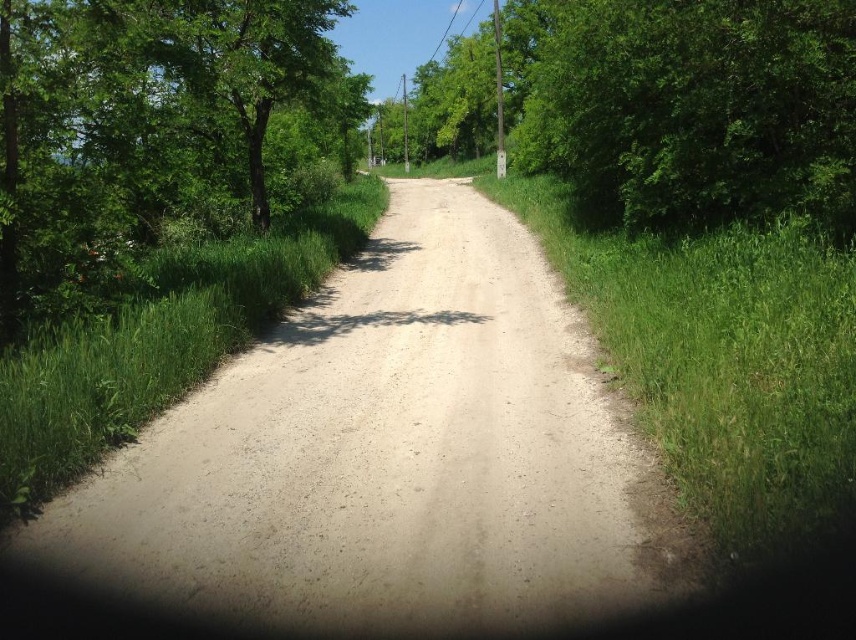
Question: Based on their relative distances, which object is farther from the green grass at left?

Choices:
 (A) green leafy tree at left
 (B) dirt track at center

Answer: (A)

Question: Estimate the real-world distances between objects in this image. Which object is farther from the green grass at left?

Choices:
 (A) green leafy tree at center
 (B) green leafy tree at left

Answer: (A)

Question: Is dirt track at center further to camera compared to green grass at left?

Choices:
 (A) no
 (B) yes

Answer: (A)

Question: Which of these objects is positioned closest to the green grass at left?

Choices:
 (A) green leafy tree at left
 (B) dirt track at center
 (C) green leafy tree at center

Answer: (B)

Question: Can you confirm if green leafy tree at center is positioned below green grass at left?

Choices:
 (A) no
 (B) yes

Answer: (A)

Question: Does dirt track at center appear on the right side of green leafy tree at center?

Choices:
 (A) no
 (B) yes

Answer: (A)